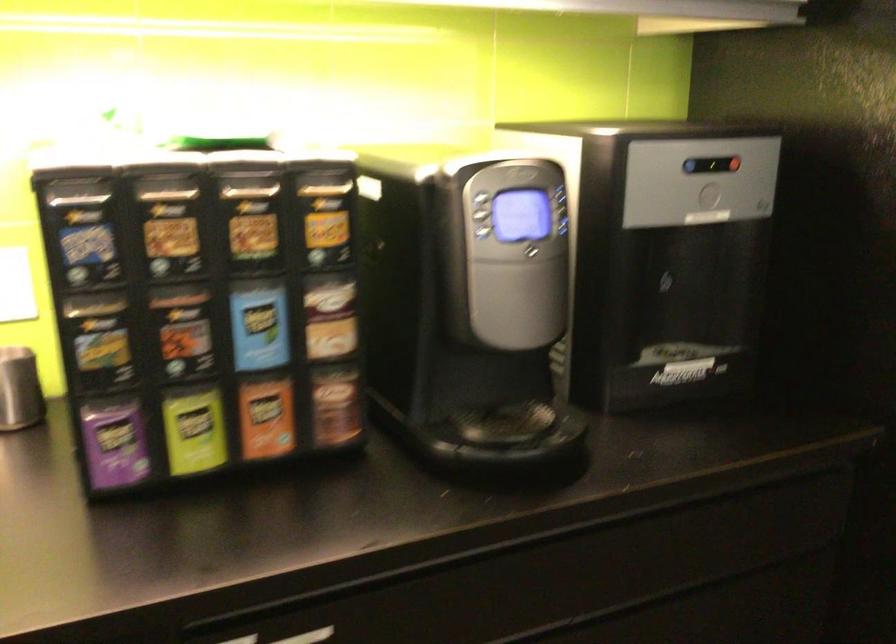
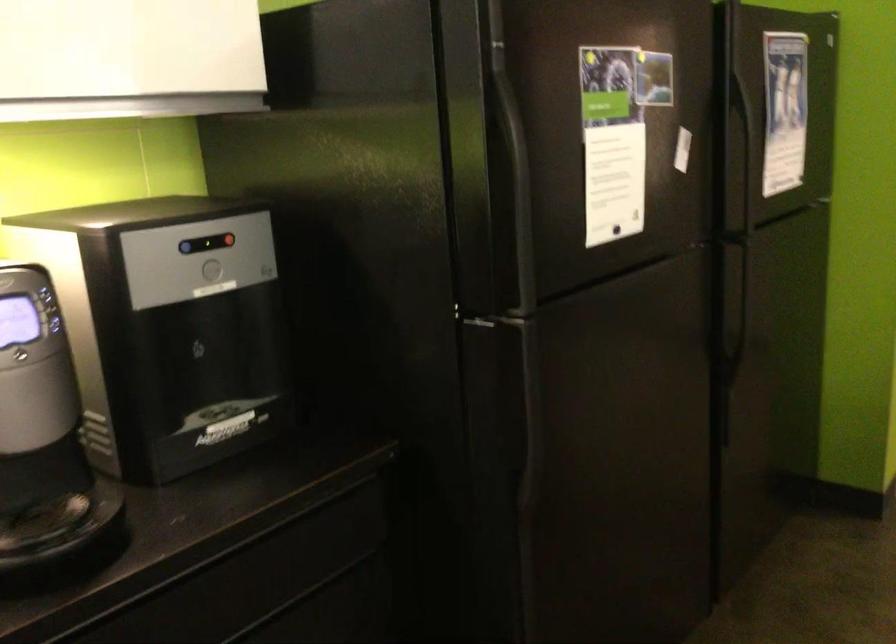
Question: The images are taken continuously from a first-person perspective. In which direction is your viewpoint rotating?

Choices:
 (A) Left
 (B) Right
 (C) Up
 (D) Down

Answer: (B)